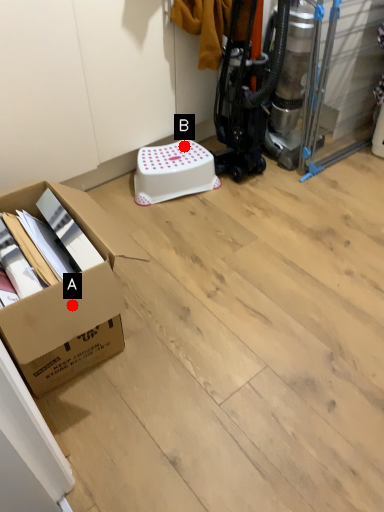
Question: Two points are circled on the image, labeled by A and B beside each circle. Which point is further to the camera?

Choices:
 (A) A is further
 (B) B is further

Answer: (B)